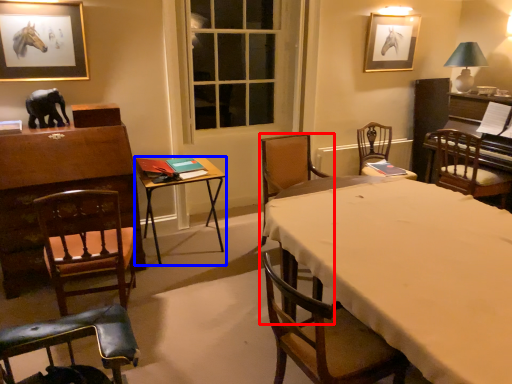
Question: Which of the following is the closest to the observer, chair (highlighted by a red box) or table (highlighted by a blue box)?

Choices:
 (A) chair
 (B) table

Answer: (A)